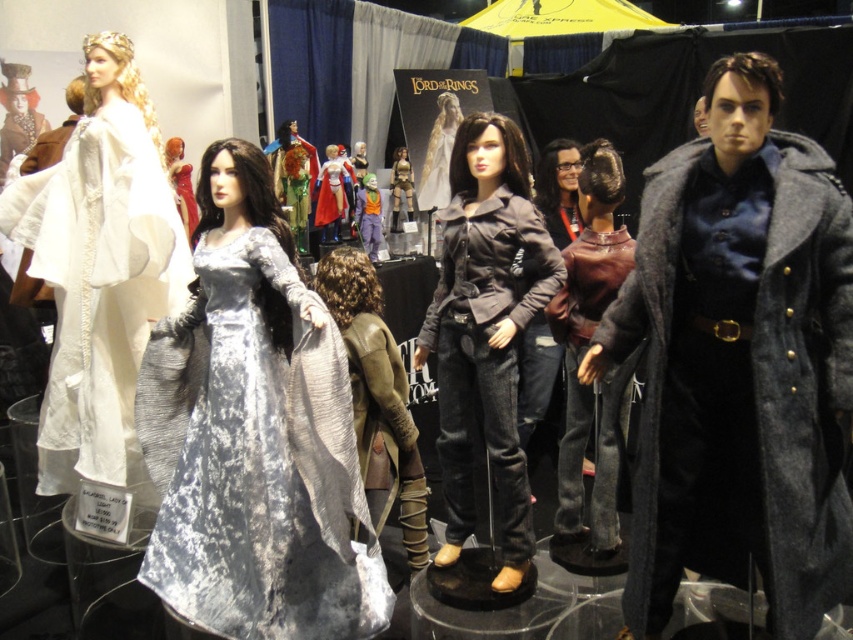
Question: From the image, what is the correct spatial relationship of silver velvet gown at center in relation to shiny red dress at center?

Choices:
 (A) right
 (B) left

Answer: (A)

Question: Which point is closer to the camera?

Choices:
 (A) burgundy leather jacket at center
 (B) silky white gown at center
 (C) shiny red dress at center

Answer: (A)

Question: Which object is farther from the camera taking this photo?

Choices:
 (A) matte gray coat at center
 (B) matte black jacket at center
 (C) metallic gold armor at center

Answer: (C)

Question: Which is farther from the burgundy leather jacket at center?

Choices:
 (A) silver velvet gown at center
 (B) metallic gold armor at center
 (C) shiny red dress at center
 (D) silky white gown at center

Answer: (B)

Question: Is matte gray coat at center bigger than matte black jacket at center?

Choices:
 (A) yes
 (B) no

Answer: (B)

Question: Is the position of silver velvet gown at center less distant than that of shiny red dress at center?

Choices:
 (A) yes
 (B) no

Answer: (A)